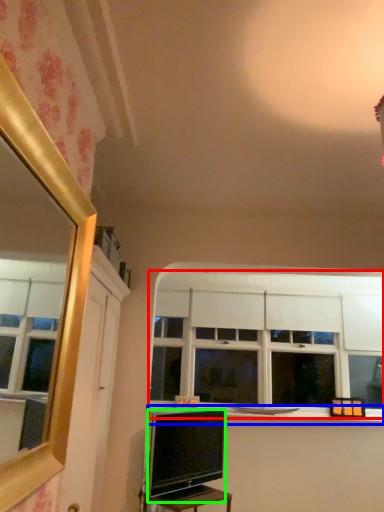
Question: Estimate the real-world distances between objects in this image. Which object is farther from window (highlighted by a red box), window sill (highlighted by a blue box) or television (highlighted by a green box)?

Choices:
 (A) window sill
 (B) television

Answer: (B)